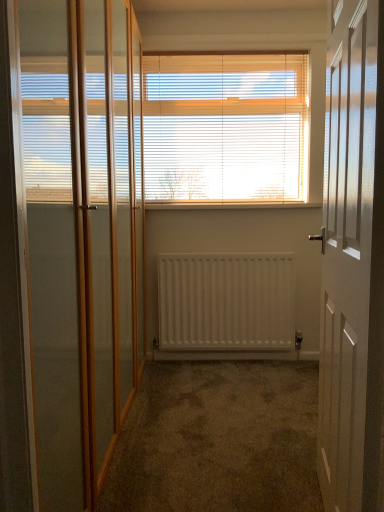
Where is `vacant space in front of white matte radiator at center`? vacant space in front of white matte radiator at center is located at coordinates (226, 392).